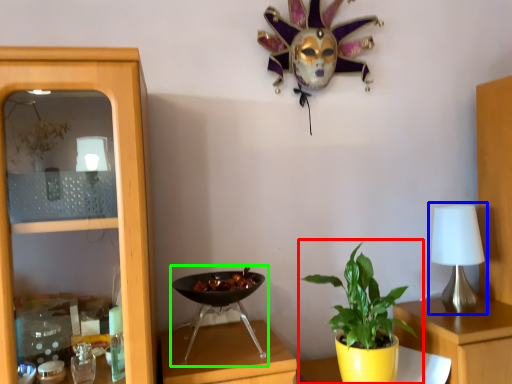
Question: Estimate the real-world distances between objects in this image. Which object is farther from houseplant (highlighted by a red box), table lamp (highlighted by a blue box) or wok (highlighted by a green box)?

Choices:
 (A) table lamp
 (B) wok

Answer: (A)